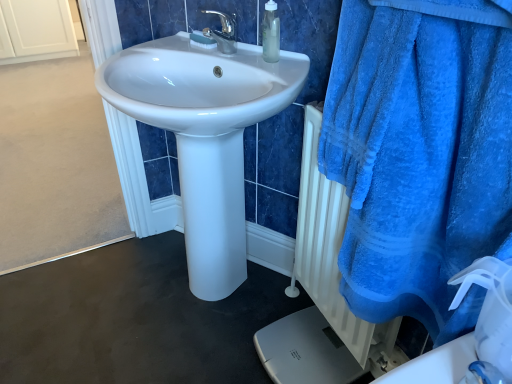
Question: Is blue plush towel at right positioned with its back to white plastic brush at upper center?

Choices:
 (A) yes
 (B) no

Answer: (B)

Question: From the image's perspective, is blue plush towel at right on top of white plastic brush at upper center?

Choices:
 (A) yes
 (B) no

Answer: (B)

Question: Is blue plush towel at right at the left side of white plastic brush at upper center?

Choices:
 (A) yes
 (B) no

Answer: (B)

Question: Can you confirm if blue plush towel at right is bigger than white plastic brush at upper center?

Choices:
 (A) no
 (B) yes

Answer: (B)

Question: Can you confirm if blue plush towel at right is wider than white plastic brush at upper center?

Choices:
 (A) no
 (B) yes

Answer: (B)

Question: Does point (270, 43) appear closer or farther from the camera than point (193, 39)?

Choices:
 (A) closer
 (B) farther

Answer: (A)

Question: Would you say translucent plastic bottle at upper center is to the left or to the right of white plastic brush at upper center in the picture?

Choices:
 (A) left
 (B) right

Answer: (B)

Question: Is translucent plastic bottle at upper center bigger or smaller than white plastic brush at upper center?

Choices:
 (A) small
 (B) big

Answer: (B)

Question: Which is correct: translucent plastic bottle at upper center is inside white plastic brush at upper center, or outside of it?

Choices:
 (A) inside
 (B) outside

Answer: (B)

Question: Is translucent plastic bottle at upper center inside the boundaries of blue plush towel at right, or outside?

Choices:
 (A) inside
 (B) outside

Answer: (B)

Question: Is translucent plastic bottle at upper center bigger or smaller than blue plush towel at right?

Choices:
 (A) small
 (B) big

Answer: (A)

Question: Is translucent plastic bottle at upper center wider or thinner than blue plush towel at right?

Choices:
 (A) wide
 (B) thin

Answer: (B)

Question: From the image's perspective, relative to blue plush towel at right, is translucent plastic bottle at upper center above or below?

Choices:
 (A) above
 (B) below

Answer: (A)

Question: From a real-world perspective, is blue plush towel at right positioned above or below white plastic brush at upper center?

Choices:
 (A) below
 (B) above

Answer: (A)

Question: From the image's perspective, is blue plush towel at right positioned above or below white plastic brush at upper center?

Choices:
 (A) above
 (B) below

Answer: (B)